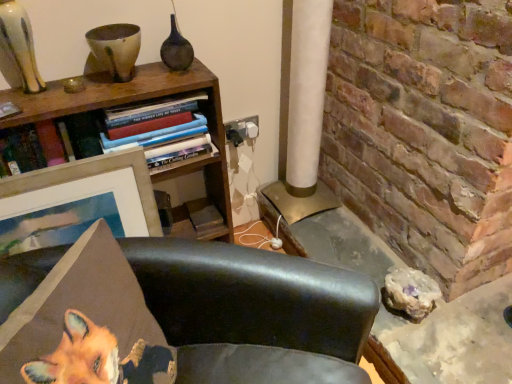
Question: Is leather chair at lower center turned away from wooden picture frame at upper left?

Choices:
 (A) yes
 (B) no

Answer: (B)

Question: Does leather chair at lower center have a lesser height compared to wooden picture frame at upper left?

Choices:
 (A) no
 (B) yes

Answer: (A)

Question: Can you confirm if leather chair at lower center is positioned to the right of wooden picture frame at upper left?

Choices:
 (A) no
 (B) yes

Answer: (B)

Question: Is leather chair at lower center aimed at wooden picture frame at upper left?

Choices:
 (A) no
 (B) yes

Answer: (A)

Question: Considering the relative sizes of leather chair at lower center and wooden picture frame at upper left in the image provided, is leather chair at lower center bigger than wooden picture frame at upper left?

Choices:
 (A) no
 (B) yes

Answer: (B)

Question: Considering their positions, is leather chair at lower center located in front of or behind metallic gold table at lower right?

Choices:
 (A) front
 (B) behind

Answer: (A)

Question: From the image's perspective, is leather chair at lower center located above or below metallic gold table at lower right?

Choices:
 (A) above
 (B) below

Answer: (B)

Question: Is leather chair at lower center wider or thinner than metallic gold table at lower right?

Choices:
 (A) wide
 (B) thin

Answer: (B)

Question: From a real-world perspective, is leather chair at lower center physically located above or below metallic gold table at lower right?

Choices:
 (A) above
 (B) below

Answer: (A)

Question: From a real-world perspective, is hardcover books at upper left positioned above or below metallic gold table at lower right?

Choices:
 (A) below
 (B) above

Answer: (B)

Question: In terms of height, does hardcover books at upper left look taller or shorter compared to metallic gold table at lower right?

Choices:
 (A) tall
 (B) short

Answer: (A)

Question: Is hardcover books at upper left spatially inside metallic gold table at lower right, or outside of it?

Choices:
 (A) outside
 (B) inside

Answer: (A)

Question: Considering the positions of hardcover books at upper left and metallic gold table at lower right in the image, is hardcover books at upper left wider or thinner than metallic gold table at lower right?

Choices:
 (A) wide
 (B) thin

Answer: (B)

Question: In terms of size, does hardcover books at upper left appear bigger or smaller than woodenmaterial/texturebookcase at upper left?

Choices:
 (A) big
 (B) small

Answer: (B)

Question: From a real-world perspective, relative to woodenmaterial/texturebookcase at upper left, is hardcover books at upper left vertically above or below?

Choices:
 (A) below
 (B) above

Answer: (B)